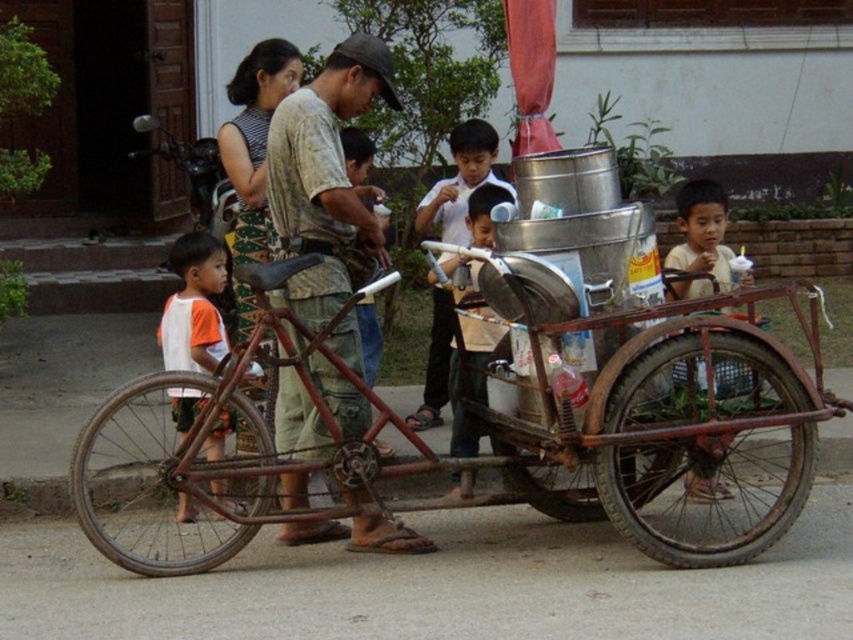
Question: Which object appears closest to the camera in this image?

Choices:
 (A) rusty metal bicycle at center
 (B) metallic silver bucket at center
 (C) matte yellow shirt at right
 (D) rusty metal tricycle at center

Answer: (D)

Question: Which point is farther to the camera?

Choices:
 (A) (215, 282)
 (B) (308, 413)

Answer: (A)

Question: Can you confirm if rusty metal tricycle at center is positioned above matte yellow shirt at right?

Choices:
 (A) no
 (B) yes

Answer: (A)

Question: Can you confirm if rusty metal tricycle at center is positioned to the right of matte yellow shirt at right?

Choices:
 (A) no
 (B) yes

Answer: (A)

Question: Estimate the real-world distances between objects in this image. Which object is closer to the matte yellow shirt at right?

Choices:
 (A) white cotton shirt at left
 (B) rusty metal tricycle at center

Answer: (B)

Question: Can you confirm if rusty metal tricycle at center is positioned below white cotton shirt at left?

Choices:
 (A) no
 (B) yes

Answer: (B)